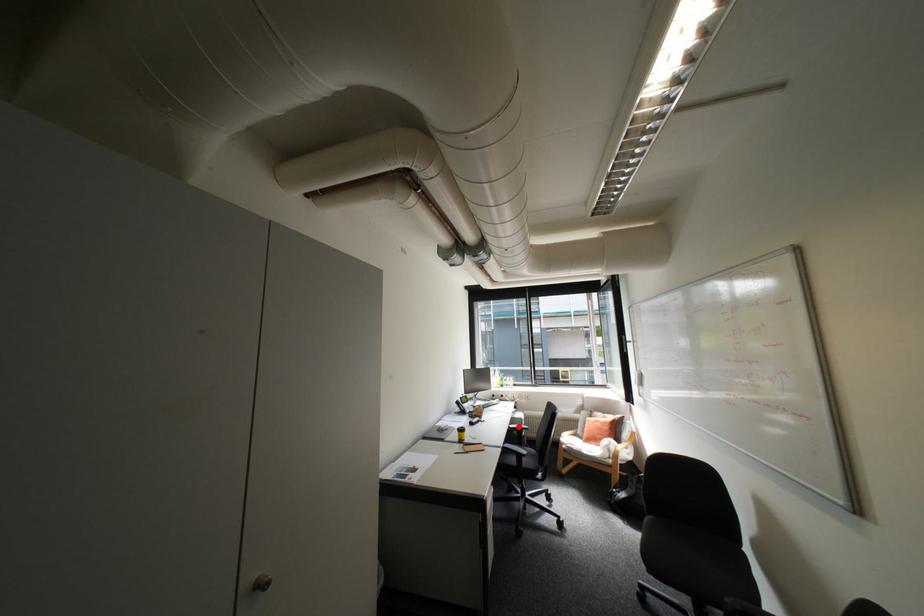
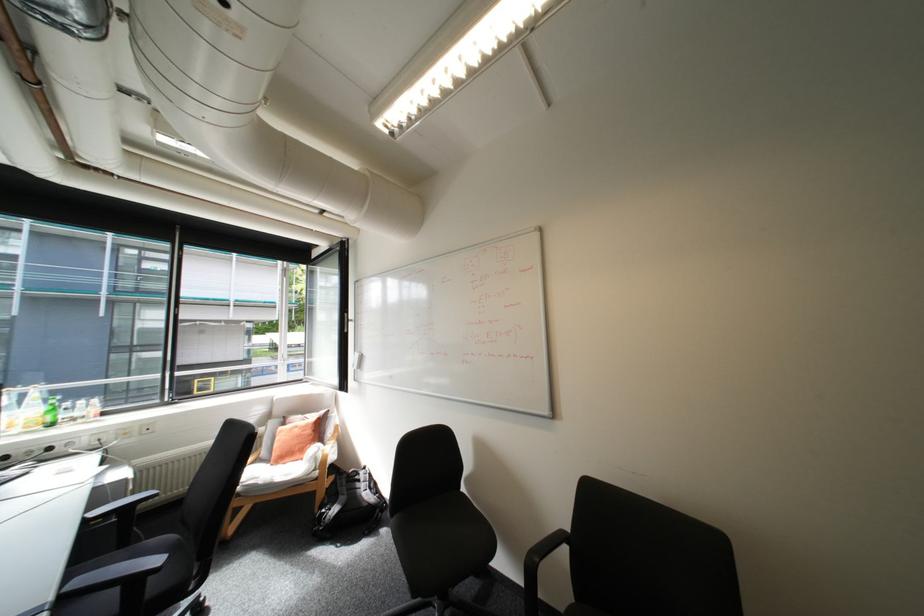
Locate, in the second image, the point that corresponds to the highlighted location in the first image.

(94, 519)